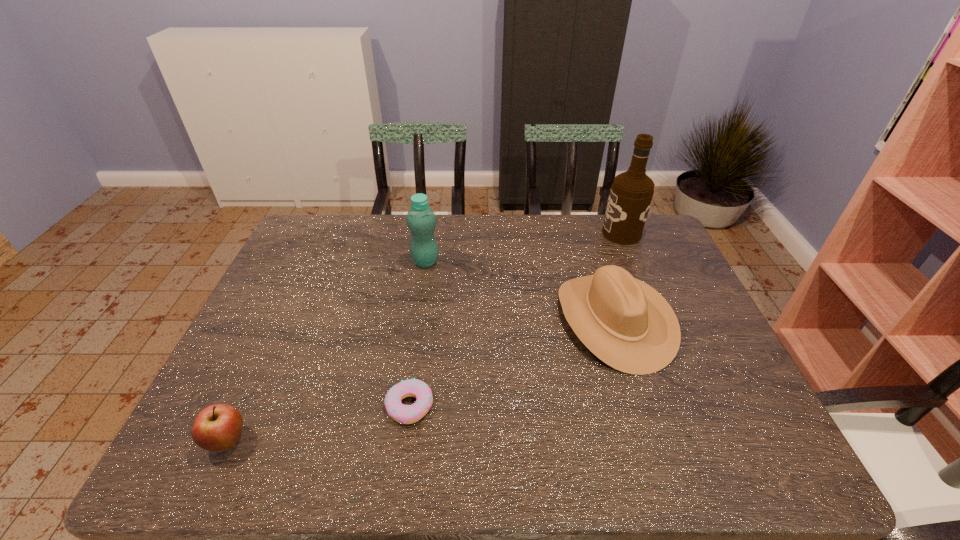
The width and height of the screenshot is (960, 540). What are the coordinates of `alcohol located in the right edge section of the desktop` in the screenshot? It's located at (631, 193).

Locate an element on the screen. cowboy hat that is positioned at the right edge is located at coordinates (626, 323).

In order to click on object that is positioned at the near left corner in this screenshot , I will do `click(218, 427)`.

In order to click on object that is at the far right corner in this screenshot , I will do `click(631, 193)`.

At what (x,y) coordinates should I click in order to perform the action: click on vacant area at the far edge. Please return your answer as a coordinate pair (x, y). Looking at the image, I should click on (550, 218).

At what (x,y) coordinates should I click in order to perform the action: click on free space at the left edge of the desktop. Please return your answer as a coordinate pair (x, y). This screenshot has height=540, width=960. Looking at the image, I should click on (229, 402).

Locate an element on the screen. vacant space at the right edge of the desktop is located at coordinates (684, 360).

In the image, there is a desktop. At what (x,y) coordinates should I click in order to perform the action: click on vacant region at the far left corner. Please return your answer as a coordinate pair (x, y). The image size is (960, 540). Looking at the image, I should click on (332, 243).

Locate an element on the screen. Image resolution: width=960 pixels, height=540 pixels. vacant space at the near right corner is located at coordinates (754, 440).

You are a GUI agent. You are given a task and a screenshot of the screen. Output one action in this format:
    pyautogui.click(x=<x>, y=<y>)
    Task: Click on the vacant area that lies between the shortest object and the cowboy hat
    The image size is (960, 540).
    Given the screenshot: What is the action you would take?
    tap(512, 363)